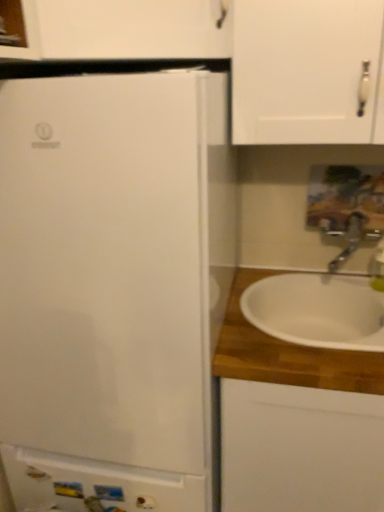
Measure the distance between satin nickel faucet at right and camera.

satin nickel faucet at right and camera are 1.40 meters apart.

Where is `white wood cabinet at right, positioned as the 1th cabinetry in right-to-left order`? This screenshot has width=384, height=512. white wood cabinet at right, positioned as the 1th cabinetry in right-to-left order is located at coordinates (287, 353).

This screenshot has width=384, height=512. What do you see at coordinates (96, 485) in the screenshot?
I see `white glossy cabinet at lower left, placed as the 2th cabinetry when sorted from right to left` at bounding box center [96, 485].

Locate an element on the screen. The image size is (384, 512). satin nickel faucet at right is located at coordinates (352, 239).

Are satin nickel faucet at right and white wood cabinet at right, which is the second cabinetry from left to right, located far from each other?

No, satin nickel faucet at right is in close proximity to white wood cabinet at right, which is the second cabinetry from left to right.

In terms of size, does satin nickel faucet at right appear bigger or smaller than white wood cabinet at right, which is the second cabinetry from left to right?

satin nickel faucet at right is smaller than white wood cabinet at right, which is the second cabinetry from left to right.

What's the angular difference between satin nickel faucet at right and white wood cabinet at right, positioned as the 1th cabinetry in right-to-left order,'s facing directions?

The angle between the facing direction of satin nickel faucet at right and the facing direction of white wood cabinet at right, positioned as the 1th cabinetry in right-to-left order, is 2.95 degrees.

Does satin nickel faucet at right appear on the right side of white wood cabinet at right, positioned as the 1th cabinetry in right-to-left order?

Yes.

Does white glossy cabinet at lower left, the first cabinetry from the left, contain white wood cabinet at right, which is the second cabinetry from left to right?

No, white glossy cabinet at lower left, the first cabinetry from the left, does not contain white wood cabinet at right, which is the second cabinetry from left to right.

From a real-world perspective, is white glossy cabinet at lower left, the first cabinetry from the left, above or below white wood cabinet at right, positioned as the 1th cabinetry in right-to-left order?

In terms of real-world spatial position, white glossy cabinet at lower left, the first cabinetry from the left, is below white wood cabinet at right, positioned as the 1th cabinetry in right-to-left order.

Is white glossy cabinet at lower left, placed as the 2th cabinetry when sorted from right to left, positioned far away from white wood cabinet at right, which is the second cabinetry from left to right?

They are positioned close to each other.

Consider the image. Would you say satin nickel faucet at right is outside white glossy cabinet at lower left, the first cabinetry from the left?

satin nickel faucet at right is positioned outside white glossy cabinet at lower left, the first cabinetry from the left.

From a real-world perspective, is satin nickel faucet at right physically below white glossy cabinet at lower left, the first cabinetry from the left?

Actually, satin nickel faucet at right is physically above white glossy cabinet at lower left, the first cabinetry from the left, in the real world.

Looking at this image, from the image's perspective, is satin nickel faucet at right located beneath white glossy cabinet at lower left, the first cabinetry from the left?

No, from the image's perspective, satin nickel faucet at right is not beneath white glossy cabinet at lower left, the first cabinetry from the left.

Can you tell me how much satin nickel faucet at right and white glossy cabinet at lower left, placed as the 2th cabinetry when sorted from right to left, differ in facing direction?

The facing directions of satin nickel faucet at right and white glossy cabinet at lower left, placed as the 2th cabinetry when sorted from right to left, are 1.65 degrees apart.

From the image's perspective, is white ceramic sink at right located above or below white wood cabinet at right, which is the second cabinetry from left to right?

Based on their image positions, white ceramic sink at right is located above white wood cabinet at right, which is the second cabinetry from left to right.

Where is `sink behind the white wood cabinet at right, which is the second cabinetry from left to right`? The width and height of the screenshot is (384, 512). sink behind the white wood cabinet at right, which is the second cabinetry from left to right is located at coordinates (320, 305).

Is white ceramic sink at right smaller than white wood cabinet at right, which is the second cabinetry from left to right?

Yes.

Which object is positioned more to the right, white ceramic sink at right or white wood cabinet at right, positioned as the 1th cabinetry in right-to-left order?

From the viewer's perspective, white wood cabinet at right, positioned as the 1th cabinetry in right-to-left order, appears more on the right side.

Between white wood cabinet at right, positioned as the 1th cabinetry in right-to-left order, and satin nickel faucet at right, which one appears on the right side from the viewer's perspective?

From the viewer's perspective, satin nickel faucet at right appears more on the right side.

Are white wood cabinet at right, which is the second cabinetry from left to right, and satin nickel faucet at right far apart?

No, white wood cabinet at right, which is the second cabinetry from left to right, is not far from satin nickel faucet at right.

Looking at this image, from the image's perspective, is white wood cabinet at right, which is the second cabinetry from left to right, under satin nickel faucet at right?

Yes, from the image's perspective, white wood cabinet at right, which is the second cabinetry from left to right, is beneath satin nickel faucet at right.

Can you confirm if white wood cabinet at right, positioned as the 1th cabinetry in right-to-left order, is bigger than satin nickel faucet at right?

Yes.

I want to click on sink below the satin nickel faucet at right (from a real-world perspective), so click(x=320, y=305).

Is white ceramic sink at right oriented towards satin nickel faucet at right?

No, white ceramic sink at right is not turned towards satin nickel faucet at right.

Is white ceramic sink at right taller than satin nickel faucet at right?

No, white ceramic sink at right is not taller than satin nickel faucet at right.

Is white ceramic sink at right next to satin nickel faucet at right?

No, white ceramic sink at right is not in contact with satin nickel faucet at right.

Which is correct: white wood cabinet at right, positioned as the 1th cabinetry in right-to-left order, is inside white ceramic sink at right, or outside of it?

white wood cabinet at right, positioned as the 1th cabinetry in right-to-left order, exists outside the volume of white ceramic sink at right.

From the image's perspective, would you say white wood cabinet at right, which is the second cabinetry from left to right, is positioned over white ceramic sink at right?

No, from the image's perspective, white wood cabinet at right, which is the second cabinetry from left to right, is not on top of white ceramic sink at right.

Which point is more distant from viewer, [332,359] or [317,318]?

The point [317,318] is farther.

From a real-world perspective, which object rests below the other?

From a 3D spatial view, white wood cabinet at right, positioned as the 1th cabinetry in right-to-left order, is below.

At what (x,y) coordinates should I click in order to perform the action: click on cabinetry that is the 1st object to the left of the satin nickel faucet at right, starting at the anchor. Please return your answer as a coordinate pair (x, y). The width and height of the screenshot is (384, 512). Looking at the image, I should click on (287, 353).

Locate an element on the screen. Image resolution: width=384 pixels, height=512 pixels. cabinetry located behind the white wood cabinet at right, which is the second cabinetry from left to right is located at coordinates (96, 485).

Based on the photo, based on their spatial positions, is white glossy cabinet at lower left, placed as the 2th cabinetry when sorted from right to left, or satin nickel faucet at right further from white ceramic sink at right?

Based on the image, white glossy cabinet at lower left, placed as the 2th cabinetry when sorted from right to left, appears to be further to white ceramic sink at right.

When comparing their distances from white glossy cabinet at lower left, placed as the 2th cabinetry when sorted from right to left, does white ceramic sink at right or satin nickel faucet at right seem further?

satin nickel faucet at right lies further to white glossy cabinet at lower left, placed as the 2th cabinetry when sorted from right to left, than the other object.

Estimate the real-world distances between objects in this image. Which object is closer to satin nickel faucet at right, white wood cabinet at right, positioned as the 1th cabinetry in right-to-left order, or white ceramic sink at right?

white ceramic sink at right is closer to satin nickel faucet at right.

Looking at the image, which one is located further to white ceramic sink at right, white glossy cabinet at lower left, placed as the 2th cabinetry when sorted from right to left, or white wood cabinet at right, positioned as the 1th cabinetry in right-to-left order?

white glossy cabinet at lower left, placed as the 2th cabinetry when sorted from right to left.

Looking at the image, which one is located closer to white wood cabinet at right, positioned as the 1th cabinetry in right-to-left order, white ceramic sink at right or white glossy cabinet at lower left, placed as the 2th cabinetry when sorted from right to left?

white ceramic sink at right lies closer to white wood cabinet at right, positioned as the 1th cabinetry in right-to-left order, than the other object.

When comparing their distances from white glossy cabinet at lower left, the first cabinetry from the left, does white ceramic sink at right or white wood cabinet at right, positioned as the 1th cabinetry in right-to-left order, seem closer?

white wood cabinet at right, positioned as the 1th cabinetry in right-to-left order, lies closer to white glossy cabinet at lower left, the first cabinetry from the left, than the other object.

Looking at the image, which one is located closer to white ceramic sink at right, white wood cabinet at right, which is the second cabinetry from left to right, or white glossy cabinet at lower left, the first cabinetry from the left?

The object closer to white ceramic sink at right is white wood cabinet at right, which is the second cabinetry from left to right.

Considering their positions, is satin nickel faucet at right positioned closer to white wood cabinet at right, which is the second cabinetry from left to right, than white glossy cabinet at lower left, the first cabinetry from the left?

white glossy cabinet at lower left, the first cabinetry from the left.

I want to click on cabinetry between satin nickel faucet at right and white glossy cabinet at lower left, placed as the 2th cabinetry when sorted from right to left, from top to bottom, so click(287, 353).

You are a GUI agent. You are given a task and a screenshot of the screen. Output one action in this format:
    pyautogui.click(x=<x>, y=<y>)
    Task: Click on the sink that lies between satin nickel faucet at right and white wood cabinet at right, which is the second cabinetry from left to right, from top to bottom
    Image resolution: width=384 pixels, height=512 pixels.
    Given the screenshot: What is the action you would take?
    pyautogui.click(x=320, y=305)

This screenshot has height=512, width=384. I want to click on sink located between white glossy cabinet at lower left, the first cabinetry from the left, and white wood cabinet at right, positioned as the 1th cabinetry in right-to-left order, in the left-right direction, so click(x=320, y=305).

The height and width of the screenshot is (512, 384). I want to click on sink between satin nickel faucet at right and white glossy cabinet at lower left, the first cabinetry from the left, in the up-down direction, so click(320, 305).